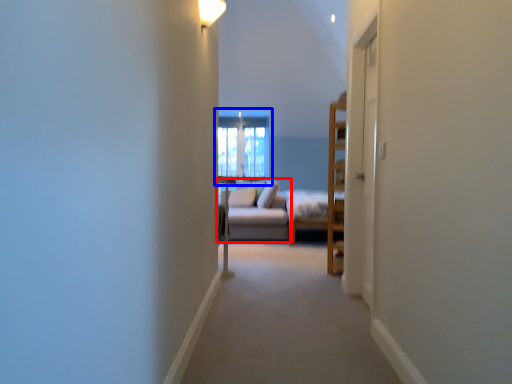
Question: Which object is closer to the camera taking this photo, studio couch (highlighted by a red box) or window (highlighted by a blue box)?

Choices:
 (A) studio couch
 (B) window

Answer: (A)